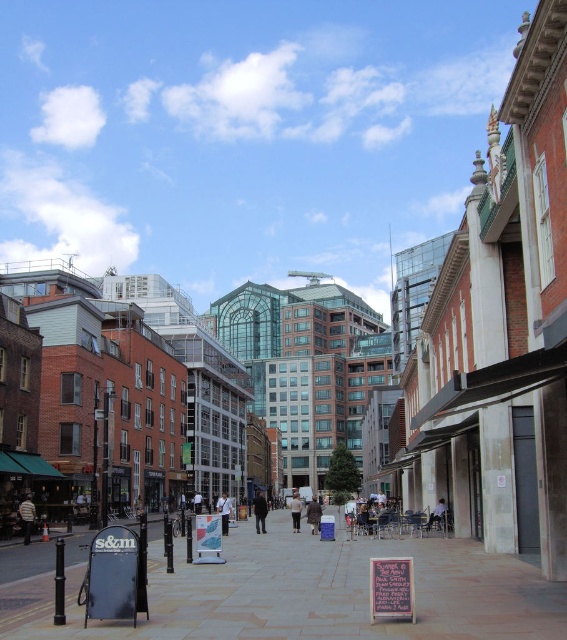
Question: Which object is closer to the camera taking this photo?

Choices:
 (A) light brown wooden chair at center
 (B) paved stone sidewalk at center

Answer: (B)

Question: Is light brown wooden chair at center bigger than light blue shirt at center?

Choices:
 (A) no
 (B) yes

Answer: (A)

Question: Does paved stone sidewalk at center appear on the left side of dark gray jacket at center?

Choices:
 (A) no
 (B) yes

Answer: (A)

Question: Which of the following is the closest to the observer?

Choices:
 (A) light blue shirt at center
 (B) light beige sweater at center

Answer: (B)

Question: Which point appears farthest from the camera in this image?

Choices:
 (A) (294, 525)
 (B) (218, 500)
 (C) (263, 513)
 (D) (198, 508)

Answer: (D)

Question: Does brown leather coat at center appear over light blue shirt at center?

Choices:
 (A) no
 (B) yes

Answer: (A)